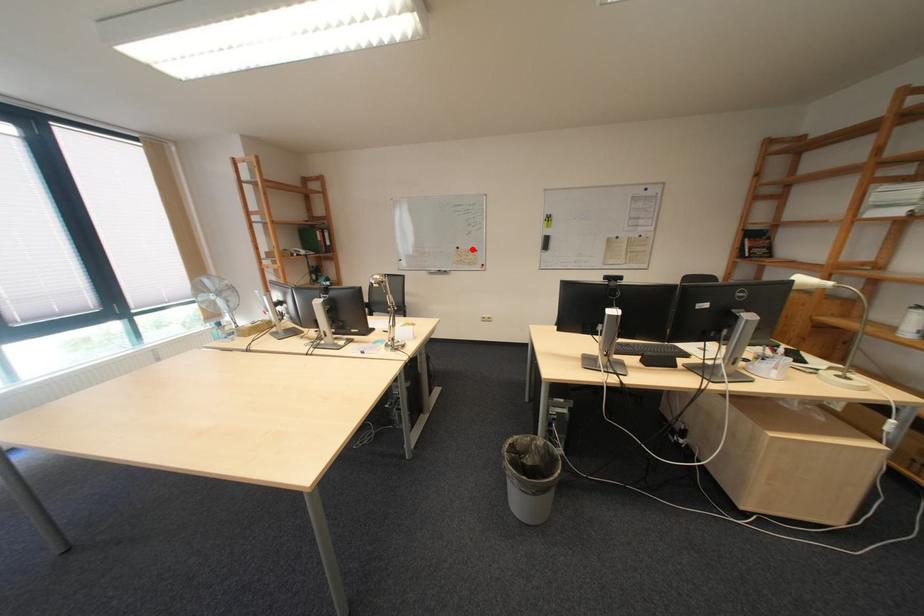
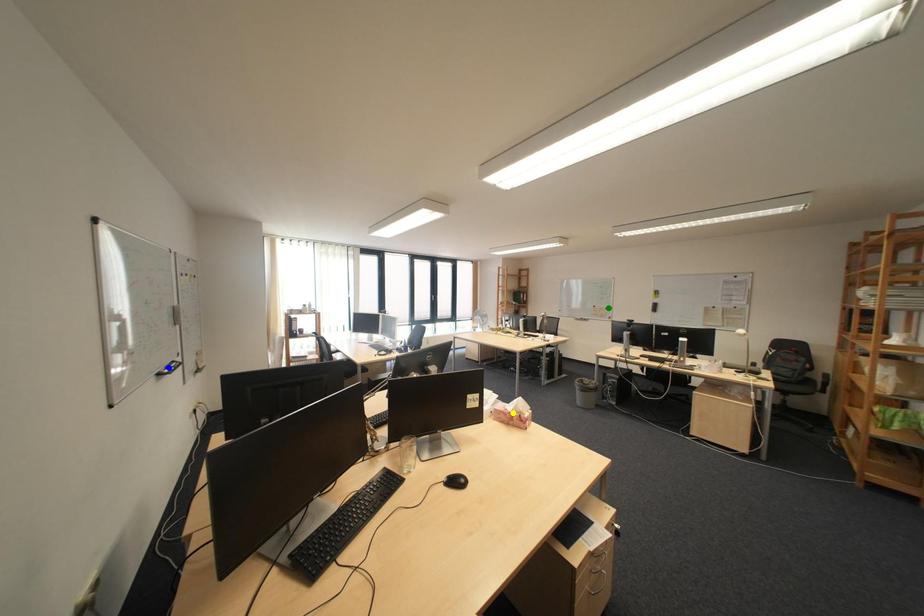
Question: I am providing you with two images of the same scene from different viewpoints. A red point is marked on the first image. You are given multiple points on the second image. In image 2, which mark is for the same physical point as the one in image 1?

Choices:
 (A) yellow point
 (B) green point
 (C) blue point

Answer: (B)